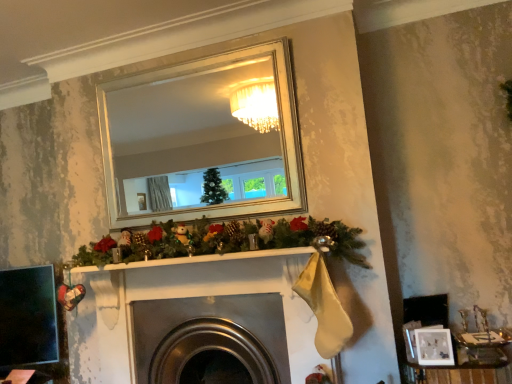
Question: Does metallic silver jewelry box at lower right have a smaller size compared to white matte picture frame at lower right?

Choices:
 (A) yes
 (B) no

Answer: (B)

Question: Considering the relative sizes of metallic silver jewelry box at lower right and white matte picture frame at lower right in the image provided, is metallic silver jewelry box at lower right thinner than white matte picture frame at lower right?

Choices:
 (A) yes
 (B) no

Answer: (B)

Question: From a real-world perspective, does metallic silver jewelry box at lower right stand above white matte picture frame at lower right?

Choices:
 (A) no
 (B) yes

Answer: (A)

Question: Could you tell me if metallic silver jewelry box at lower right is facing white matte picture frame at lower right?

Choices:
 (A) yes
 (B) no

Answer: (B)

Question: Can you confirm if metallic silver jewelry box at lower right is taller than white matte picture frame at lower right?

Choices:
 (A) yes
 (B) no

Answer: (A)

Question: Considering their positions, is white matte picture frame at lower right located in front of or behind metallic silver jewelry box at lower right?

Choices:
 (A) front
 (B) behind

Answer: (B)

Question: From the image's perspective, relative to metallic silver jewelry box at lower right, is white matte picture frame at lower right above or below?

Choices:
 (A) below
 (B) above

Answer: (B)

Question: Does point (442, 359) appear closer or farther from the camera than point (463, 367)?

Choices:
 (A) farther
 (B) closer

Answer: (B)

Question: Looking at their shapes, would you say white matte picture frame at lower right is wider or thinner than metallic silver jewelry box at lower right?

Choices:
 (A) wide
 (B) thin

Answer: (B)

Question: Is metallic silver jewelry box at lower right taller or shorter than white matte picture frame at lower right?

Choices:
 (A) short
 (B) tall

Answer: (B)

Question: In terms of width, does metallic silver jewelry box at lower right look wider or thinner when compared to white matte picture frame at lower right?

Choices:
 (A) wide
 (B) thin

Answer: (A)

Question: From a real-world perspective, is metallic silver jewelry box at lower right physically located above or below white matte picture frame at lower right?

Choices:
 (A) below
 (B) above

Answer: (A)

Question: Relative to white matte picture frame at lower right, is metallic silver jewelry box at lower right in front or behind?

Choices:
 (A) behind
 (B) front

Answer: (B)

Question: From the image's perspective, is metallic silver fireplace at center positioned above or below white matte picture frame at lower right?

Choices:
 (A) above
 (B) below

Answer: (B)

Question: Does point (142, 306) appear closer or farther from the camera than point (448, 362)?

Choices:
 (A) closer
 (B) farther

Answer: (B)